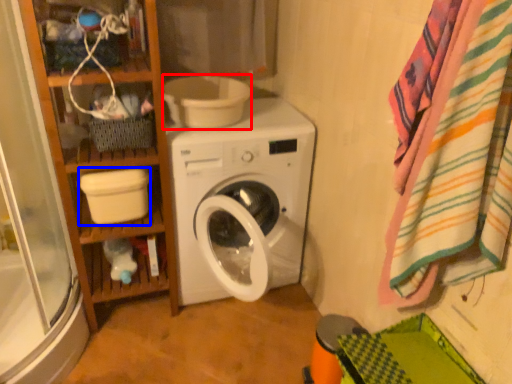
Question: Among these objects, which one is nearest to the camera, toilet bowl (highlighted by a red box) or toilet bowl (highlighted by a blue box)?

Choices:
 (A) toilet bowl
 (B) toilet bowl

Answer: (B)